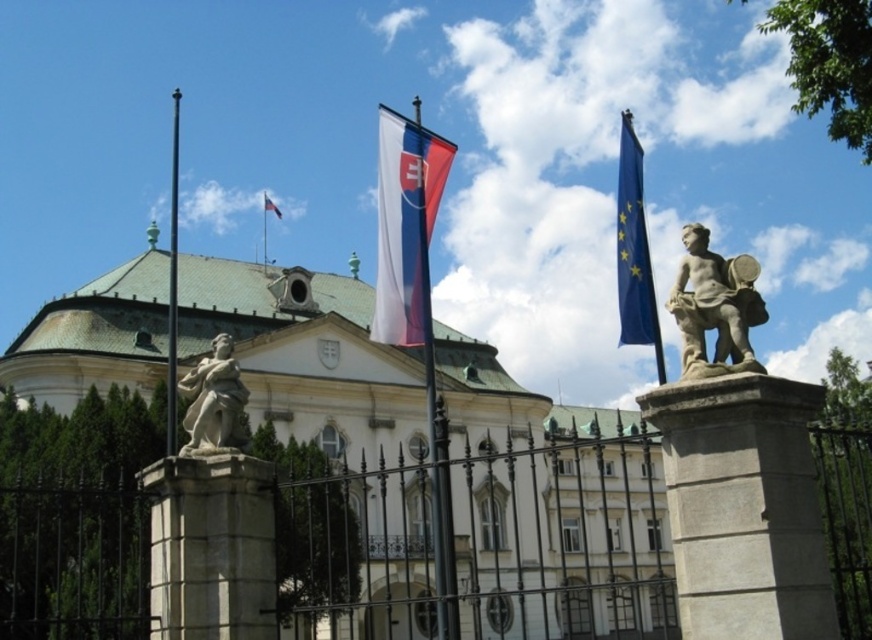
Does white fabric flag at center come in front of blue fabric flag at upper right?

No, white fabric flag at center is further to the viewer.

Who is shorter, white fabric flag at center or blue fabric flag at upper right?

blue fabric flag at upper right is shorter.

Where is `white fabric flag at center`? This screenshot has height=640, width=872. white fabric flag at center is located at coordinates (405, 224).

Measure the distance from stone statue at upper right to black metal flag pole at left.

152.47 feet

Is stone statue at upper right smaller than black metal flag pole at left?

Yes.

Is point (732, 278) in front of point (167, 419)?

Yes, it is.

At what (x,y) coordinates should I click in order to perform the action: click on stone statue at upper right. Please return your answer as a coordinate pair (x, y). Image resolution: width=872 pixels, height=640 pixels. Looking at the image, I should click on (714, 307).

In the scene shown: Who is positioned more to the right, blue fabric flag at upper right or white flagpole at upper center?

From the viewer's perspective, blue fabric flag at upper right appears more on the right side.

Can you confirm if blue fabric flag at upper right is positioned to the right of white flagpole at upper center?

Correct, you'll find blue fabric flag at upper right to the right of white flagpole at upper center.

This screenshot has width=872, height=640. I want to click on blue fabric flag at upper right, so click(632, 248).